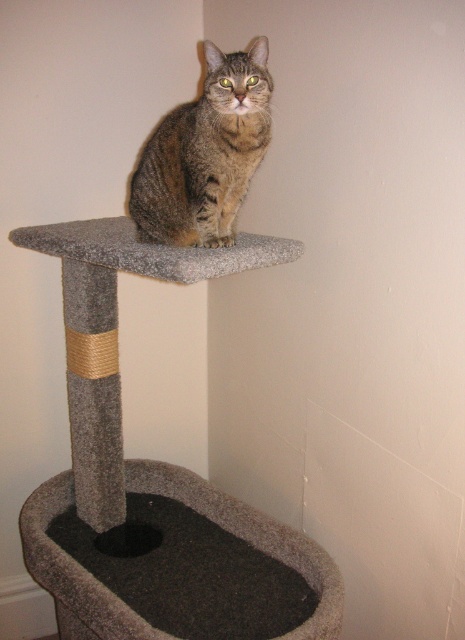
Question: Among these points, which one is nearest to the camera?

Choices:
 (A) (241, 524)
 (B) (193, 204)

Answer: (B)

Question: Does tabby fur cat at center have a greater width compared to dark gray carpeted cat bed at lower center?

Choices:
 (A) no
 (B) yes

Answer: (A)

Question: Is tabby fur cat at center further to the viewer compared to dark gray carpeted cat bed at lower center?

Choices:
 (A) yes
 (B) no

Answer: (A)

Question: Does tabby fur cat at center appear on the right side of dark gray carpeted cat bed at lower center?

Choices:
 (A) yes
 (B) no

Answer: (A)

Question: Which point appears closest to the camera in this image?

Choices:
 (A) (203, 141)
 (B) (319, 556)

Answer: (A)